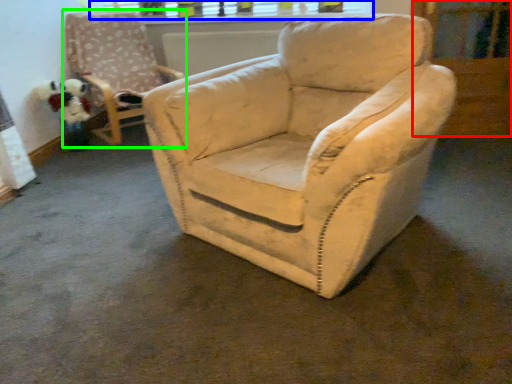
Question: Considering the real-world distances, which object is closest to screen door (highlighted by a red box)? window frame (highlighted by a blue box) or chair (highlighted by a green box).

Choices:
 (A) window frame
 (B) chair

Answer: (A)